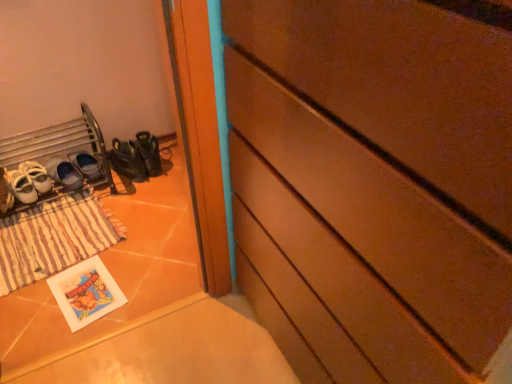
Find the location of a particular element. free space above matte paper postcard at lower left (from a real-world perspective) is located at coordinates (91, 282).